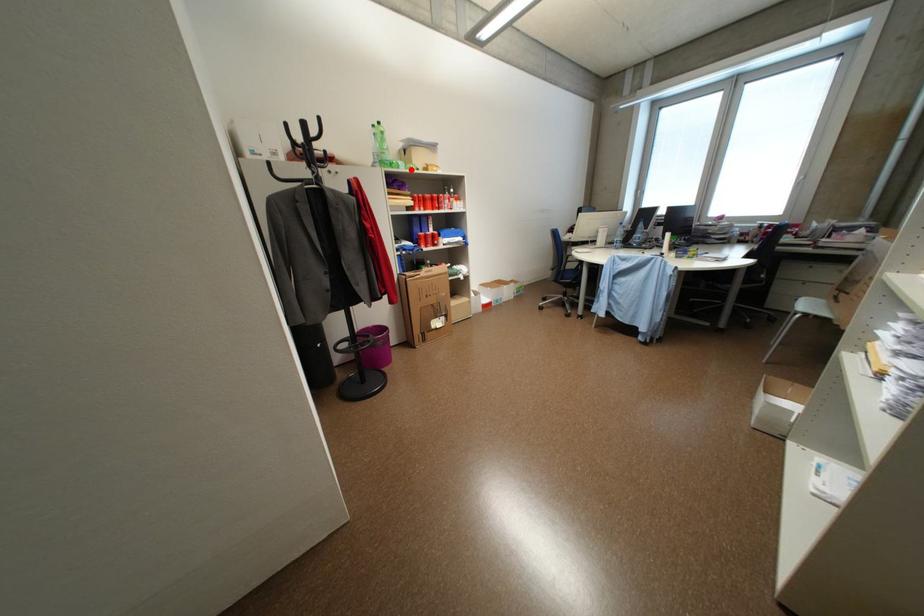
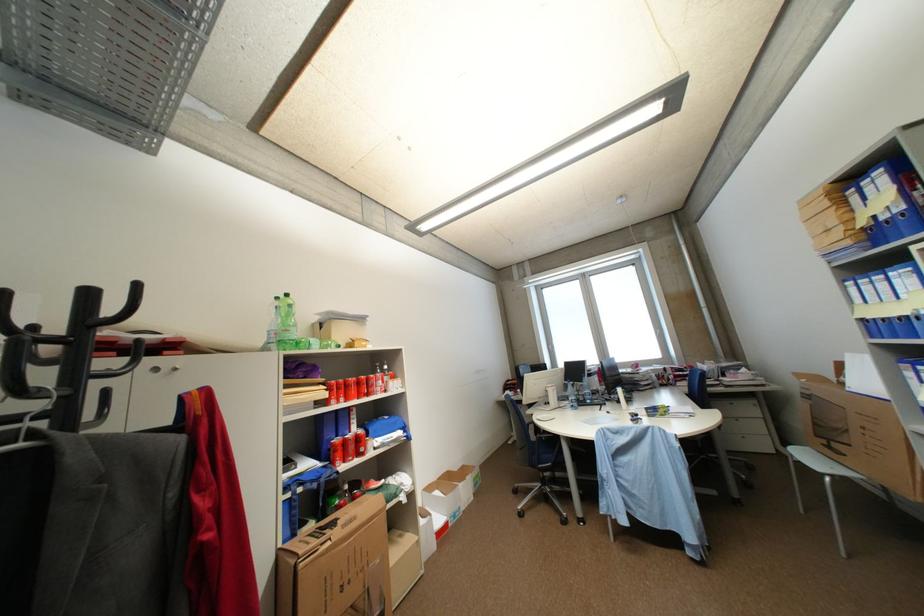
Question: I am providing you with two images of the same scene from different viewpoints. A red point is marked on the first image. At the location where the point appears in image 1, is it still visible in image 2?

Choices:
 (A) Yes
 (B) No

Answer: (A)